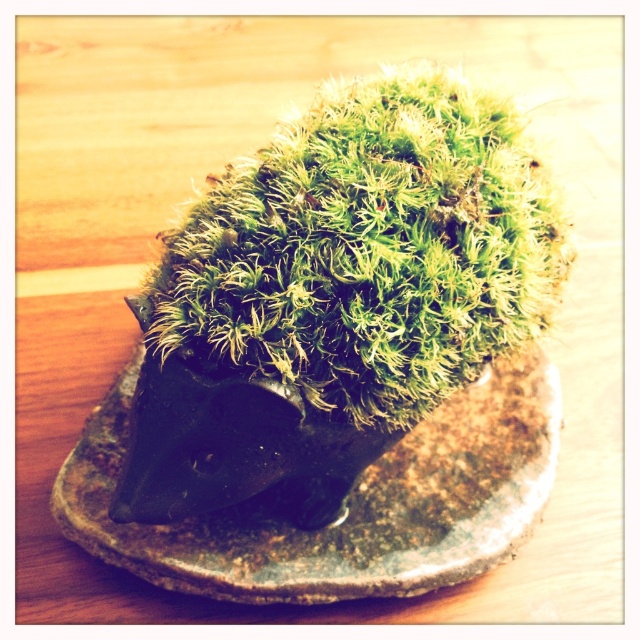
You are an interior designer planning to place a small decorative item in a narrow space. You have two options from the image provided. Which one between the green mossy hedgehog at center and the green mossy stone at center would you choose to fit better in the narrow space?

The green mossy hedgehog at center has a lesser width compared to the green mossy stone at center, so it would fit better in a narrow space.

You are a gardener who wants to place a new decorative item between the green mossy hedgehog at center and the green mossy stone at center. The item you have is 15 centimeters long. Is there enough space between them to fit your item?

The distance between the green mossy hedgehog at center and the green mossy stone at center is 21.13 centimeters. Since the item is 15 centimeters long, there is enough space to fit it between them.

Looking at this image, you are standing in front of a decorative display and see the green mossy hedgehog at center and the green mossy stone at center. Which one is closer to you?

The green mossy hedgehog at center is closer to the viewer than the green mossy stone at center.